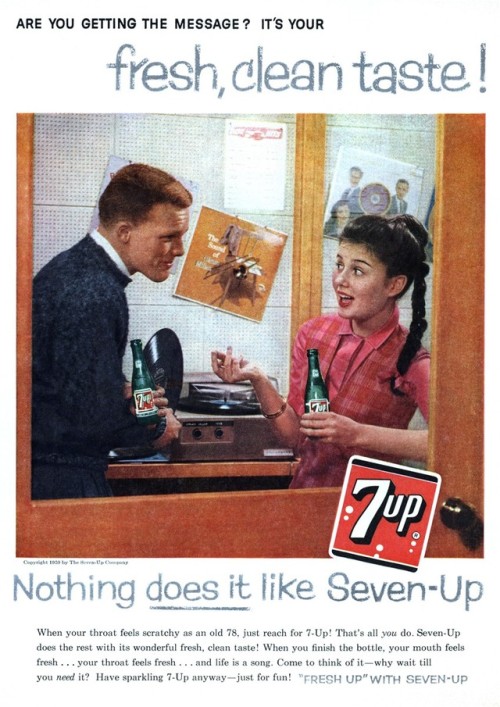
The height and width of the screenshot is (707, 500). In order to click on album art on wall with people in this screenshot , I will do [391, 184].